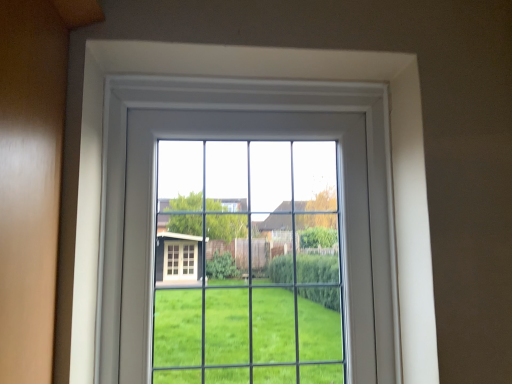
This screenshot has width=512, height=384. What do you see at coordinates (233, 139) in the screenshot?
I see `clear glass window at center` at bounding box center [233, 139].

Find the location of a particular element. This screenshot has height=384, width=512. clear glass window at center is located at coordinates (233, 139).

The width and height of the screenshot is (512, 384). I want to click on clear glass window at center, so click(233, 139).